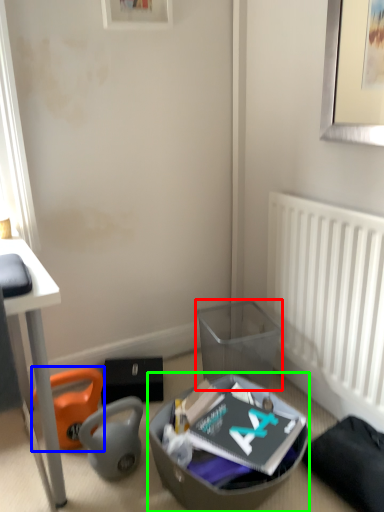
Question: Based on their relative distances, which object is farther from trash bin/can (highlighted by a red box)? Choose from bean bag chair (highlighted by a blue box) and shoe box (highlighted by a green box).

Choices:
 (A) bean bag chair
 (B) shoe box

Answer: (A)